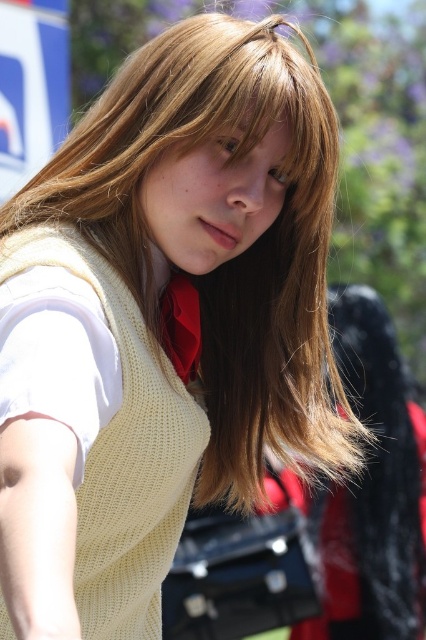
Question: Which point is farther to the camera?

Choices:
 (A) (178, 284)
 (B) (196, 403)

Answer: (B)

Question: Is the position of light yellow knitted sweater at center less distant than that of matte red tie at center?

Choices:
 (A) no
 (B) yes

Answer: (B)

Question: Does light yellow knitted sweater at center have a lesser width compared to matte red tie at center?

Choices:
 (A) yes
 (B) no

Answer: (B)

Question: Can you confirm if blonde hair at center is smaller than light yellow knitted sweater at center?

Choices:
 (A) yes
 (B) no

Answer: (B)

Question: Which of these objects is positioned closest to the light yellow knitted sweater at center?

Choices:
 (A) blonde hair at center
 (B) matte red tie at center

Answer: (B)

Question: Which of these objects is positioned farthest from the light yellow knitted sweater at center?

Choices:
 (A) blonde hair at center
 (B) matte red tie at center

Answer: (A)